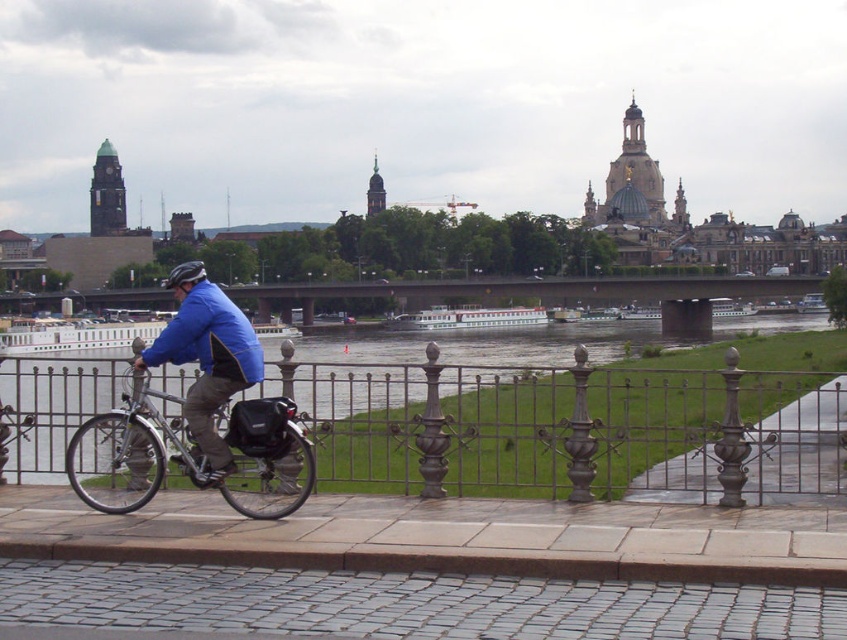
You are a pedestrian standing on the cobblestone pathway and want to cross the path to reach the grassy area. The silver metallic bicycle at center is in your way. Can you walk around it without going past the blue matte jacket at center?

The silver metallic bicycle at center is shorter than blue matte jacket at center. Since the bicycle is shorter, you can walk around it on either side, but you must stay behind the blue matte jacket at center to avoid going past it.

You are a pedestrian standing on the cobblestone pathway and want to cross to the grassy area beyond the metal railing. The silver metallic bicycle at center and the blue matte jacket at center are in your path. Which object should you move around first?

The silver metallic bicycle at center is closer to the viewer than the blue matte jacket at center, so you should move around the silver metallic bicycle at center first.

You are a pedestrian standing on the cobblestone pathway and want to know if the silver metallic bicycle at center is taller than the shiny black helmet at center. Based on the scene, can you determine which object is taller?

The silver metallic bicycle at center has a lesser height compared to shiny black helmet at center, so the shiny black helmet at center is taller.